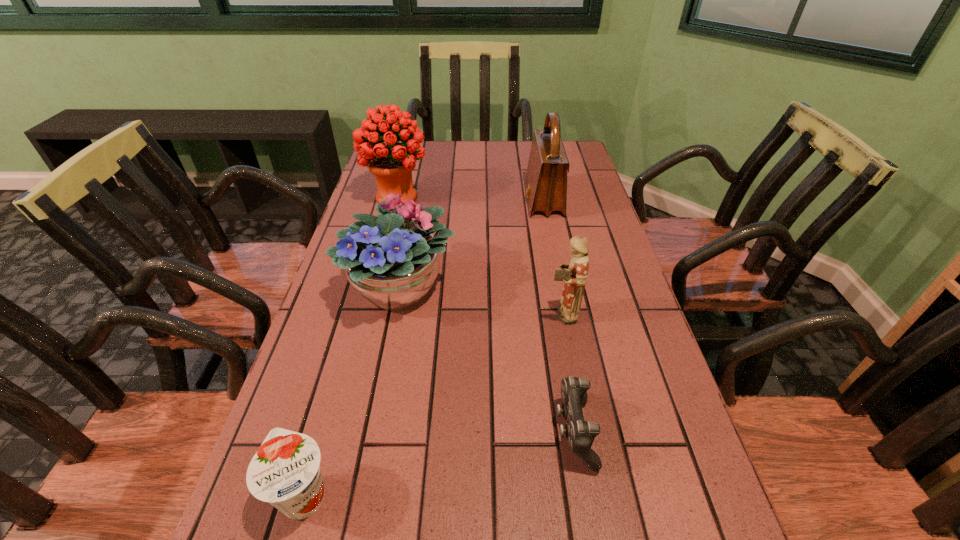
Where is `blank space located 0.060m on the right of the shorter bouquet`? Image resolution: width=960 pixels, height=540 pixels. blank space located 0.060m on the right of the shorter bouquet is located at coordinates (482, 287).

Locate an element on the screen. The image size is (960, 540). vacant space located 0.100m on the front-facing side of the figurine is located at coordinates (503, 314).

Locate an element on the screen. The width and height of the screenshot is (960, 540). blank area located on the front-facing side of the figurine is located at coordinates (371, 314).

At what (x,y) coordinates should I click in order to perform the action: click on vacant space located 0.260m on the front-facing side of the figurine. Please return your answer as a coordinate pair (x, y). The height and width of the screenshot is (540, 960). Looking at the image, I should click on (432, 314).

The width and height of the screenshot is (960, 540). In order to click on vacant area situated on the back of the yogurt in this screenshot , I will do `click(338, 377)`.

At what (x,y) coordinates should I click in order to perform the action: click on free spot located 0.060m on the surface of the control with buttons. Please return your answer as a coordinate pair (x, y). Looking at the image, I should click on (522, 431).

Locate an element on the screen. Image resolution: width=960 pixels, height=540 pixels. free space located on the surface of the control with buttons is located at coordinates (348, 431).

Find the location of a particular element. This screenshot has height=540, width=960. vacant point located on the surface of the control with buttons is located at coordinates pos(438,431).

Find the location of a particular element. yogurt that is at the left edge is located at coordinates (285, 471).

At what (x,y) coordinates should I click in order to perform the action: click on shoulder bag that is positioned at the right edge. Please return your answer as a coordinate pair (x, y). The width and height of the screenshot is (960, 540). Looking at the image, I should click on (546, 178).